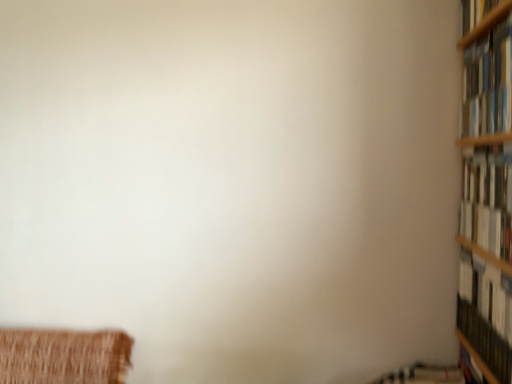
Question: Is white paper book at right, the second book from the top, not close to hardcover book at right, acting as the first book starting from the bottom?

Choices:
 (A) no
 (B) yes

Answer: (A)

Question: From a real-world perspective, is white paper book at right, the second book from the top, physically above hardcover book at right, acting as the first book starting from the bottom?

Choices:
 (A) yes
 (B) no

Answer: (A)

Question: Can you confirm if white paper book at right, the 2th book from the bottom, is positioned to the right of hardcover book at right, the third book when ordered from top to bottom?

Choices:
 (A) no
 (B) yes

Answer: (A)

Question: Is white paper book at right, the 2th book from the bottom, with hardcover book at right, the third book when ordered from top to bottom?

Choices:
 (A) yes
 (B) no

Answer: (B)

Question: Is white paper book at right, the 2th book from the bottom, bigger than hardcover book at right, the third book when ordered from top to bottom?

Choices:
 (A) yes
 (B) no

Answer: (A)

Question: From their relative heights in the image, would you say hardcover books at upper right, which is counted as the first book, starting from the top, is taller or shorter than white paper book at right, the 2th book from the bottom?

Choices:
 (A) tall
 (B) short

Answer: (B)

Question: In the image, is hardcover books at upper right, which is counted as the first book, starting from the top, positioned in front of or behind white paper book at right, the 2th book from the bottom?

Choices:
 (A) behind
 (B) front

Answer: (B)

Question: Choose the correct answer: Is hardcover books at upper right, which is counted as the first book, starting from the top, inside white paper book at right, the 2th book from the bottom, or outside it?

Choices:
 (A) inside
 (B) outside

Answer: (B)

Question: Visually, is hardcover books at upper right, the third book positioned from the bottom, positioned to the left or to the right of white paper book at right, the 2th book from the bottom?

Choices:
 (A) left
 (B) right

Answer: (A)

Question: Considering their positions, is white paper book at right, the 2th book from the bottom, located in front of or behind hardcover books at upper right, which is counted as the first book, starting from the top?

Choices:
 (A) behind
 (B) front

Answer: (A)

Question: From the image's perspective, is white paper book at right, the second book from the top, positioned above or below hardcover books at upper right, the third book positioned from the bottom?

Choices:
 (A) below
 (B) above

Answer: (A)

Question: Looking at their shapes, would you say white paper book at right, the 2th book from the bottom, is wider or thinner than hardcover books at upper right, the third book positioned from the bottom?

Choices:
 (A) thin
 (B) wide

Answer: (A)

Question: In terms of size, does white paper book at right, the 2th book from the bottom, appear bigger or smaller than hardcover books at upper right, the third book positioned from the bottom?

Choices:
 (A) big
 (B) small

Answer: (B)

Question: From a real-world perspective, is hardcover book at right, the third book when ordered from top to bottom, above or below white paper book at right, the 2th book from the bottom?

Choices:
 (A) below
 (B) above

Answer: (A)

Question: In terms of size, does hardcover book at right, acting as the first book starting from the bottom, appear bigger or smaller than white paper book at right, the second book from the top?

Choices:
 (A) big
 (B) small

Answer: (B)